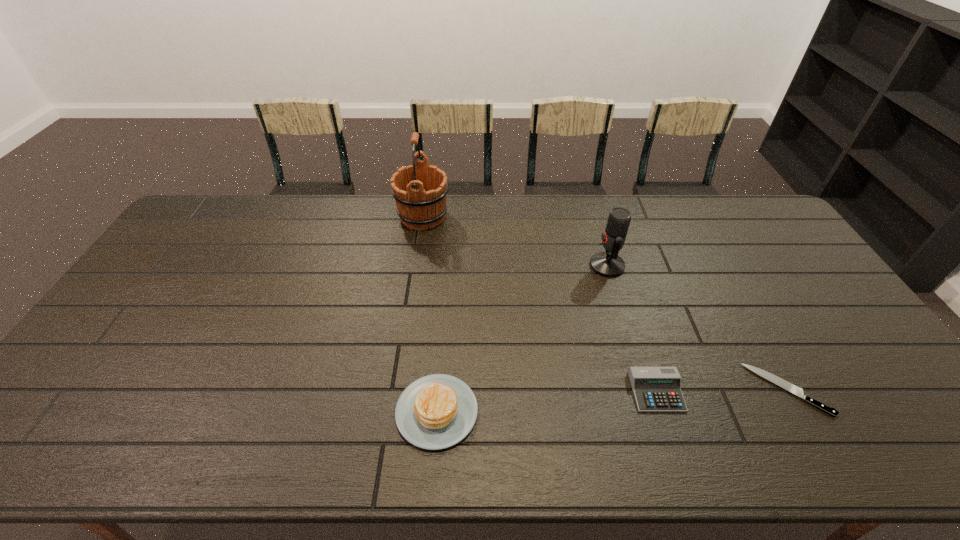
Find the location of a particular element. vacant space at the right edge of the desktop is located at coordinates (764, 255).

I want to click on free space between the pancake and the second tallest object, so click(x=522, y=339).

I want to click on empty space between the tallest object and the calculator, so click(540, 304).

I want to click on free point between the calculator and the microphone, so pos(632,329).

Identify the location of blank region between the shortest object and the wine bucket. (605, 303).

Locate an element on the screen. The image size is (960, 540). vacant space that is in between the shortest object and the third shortest object is located at coordinates click(612, 401).

The width and height of the screenshot is (960, 540). I want to click on vacant space that's between the pancake and the farthest object, so click(430, 314).

The image size is (960, 540). I want to click on vacant area between the third shortest object and the rightmost object, so click(612, 401).

What are the coordinates of `unoccupied area between the third shortest object and the second farthest object` in the screenshot? It's located at (522, 339).

At what (x,y) coordinates should I click in order to perform the action: click on vacant space in between the rightmost object and the calculator. Please return your answer as a coordinate pair (x, y). Image resolution: width=960 pixels, height=540 pixels. Looking at the image, I should click on (722, 390).